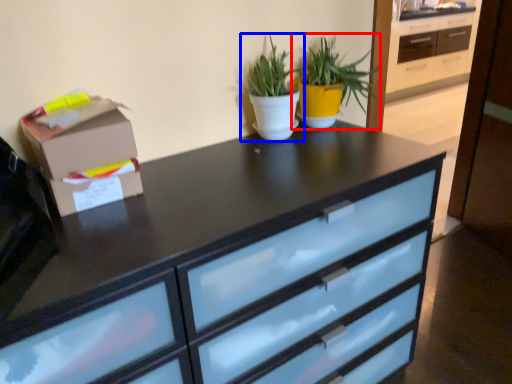
Question: Which object appears farthest to the camera in this image, houseplant (highlighted by a red box) or houseplant (highlighted by a blue box)?

Choices:
 (A) houseplant
 (B) houseplant

Answer: (A)